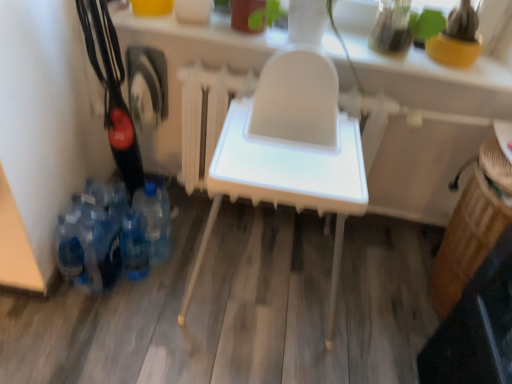
Where is `free space in front of blue translucent bottle at lower left, the second bottle in the left-to-right sequence`? This screenshot has width=512, height=384. free space in front of blue translucent bottle at lower left, the second bottle in the left-to-right sequence is located at coordinates (123, 312).